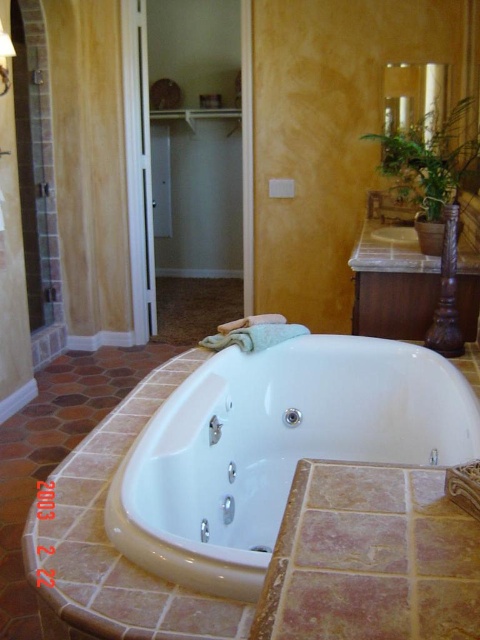
You are a delivery person who needs to place a 1.5 meter long package between the white glossy bathtub at center and the white glossy sink at center. Can you fit the package horizontally between them?

The distance between the white glossy bathtub at center and the white glossy sink at center is 1.43 meters. Since the package is 1.5 meters long, it cannot be placed horizontally between them as the space is shorter than the package length.

You are a contractor measuring bathroom fixtures. You need to install a new showerhead that requires a minimum of 1.2 meters of space between the white glossy bathtub at center and the white glossy sink at center. Based on the scene, can the showerhead be installed between them?

The white glossy bathtub at center is wider than the white glossy sink at center, but the exact distance between them isn